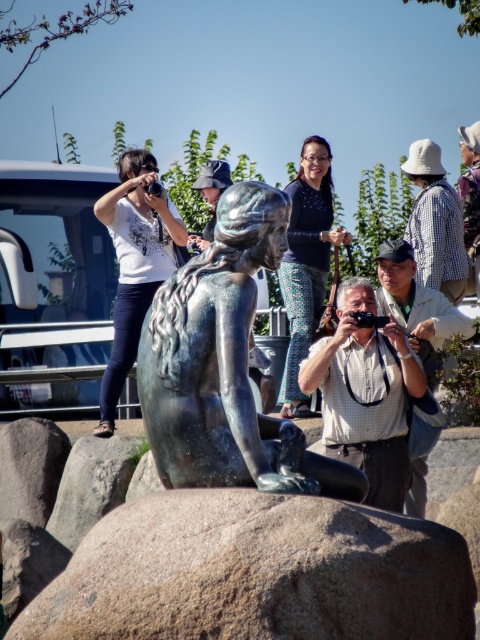
Question: Is checkered shirt camera at center bigger than matte bronze statue at center?

Choices:
 (A) no
 (B) yes

Answer: (B)

Question: Which point is closer to the camera taking this photo?

Choices:
 (A) (470, 136)
 (B) (391, 369)

Answer: (B)

Question: Is white matte shirt at upper left above matte silver camera at center?

Choices:
 (A) yes
 (B) no

Answer: (A)

Question: Which point is farther to the camera?

Choices:
 (A) white matte shirt at upper left
 (B) brown granite boulder at center
 (C) plaid shirt at center
 (D) bronze statue at center

Answer: (C)

Question: Is bronze statue at center to the right of white checkered shirt at upper right from the viewer's perspective?

Choices:
 (A) yes
 (B) no

Answer: (B)

Question: Which of the following is the farthest from the observer?

Choices:
 (A) plaid shirt at center
 (B) white checkered shirt at upper right

Answer: (A)